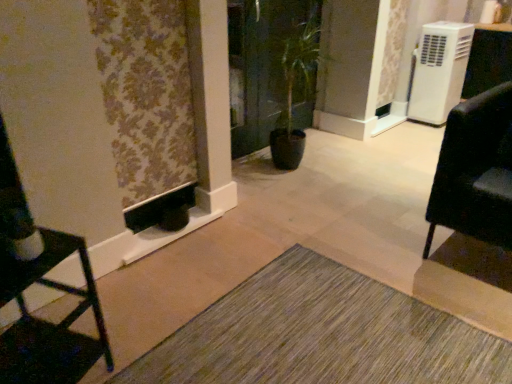
Question: From a real-world perspective, is white plastic air conditioner at upper right below matte black chair at left, the second furniture when ordered from right to left?

Choices:
 (A) yes
 (B) no

Answer: (B)

Question: Considering the relative sizes of white plastic air conditioner at upper right and matte black chair at left, acting as the first furniture starting from the front, in the image provided, is white plastic air conditioner at upper right wider than matte black chair at left, acting as the first furniture starting from the front,?

Choices:
 (A) yes
 (B) no

Answer: (B)

Question: Does white plastic air conditioner at upper right have a lesser height compared to matte black chair at left, the second furniture when ordered from right to left?

Choices:
 (A) no
 (B) yes

Answer: (A)

Question: Is there a large distance between white plastic air conditioner at upper right and matte black chair at left, acting as the first furniture starting from the front?

Choices:
 (A) yes
 (B) no

Answer: (A)

Question: From a real-world perspective, is white plastic air conditioner at upper right positioned over matte black chair at left, the second furniture when ordered from right to left, based on gravity?

Choices:
 (A) yes
 (B) no

Answer: (A)

Question: Is black leather chair at right, the 2th furniture viewed from the left, to the left or to the right of green glossy screen door at center in the image?

Choices:
 (A) right
 (B) left

Answer: (A)

Question: From a real-world perspective, is black leather chair at right, which appears as the second furniture when viewed from the front, above or below green glossy screen door at center?

Choices:
 (A) above
 (B) below

Answer: (B)

Question: From the image's perspective, is black leather chair at right, which is the first furniture from back to front, positioned above or below green glossy screen door at center?

Choices:
 (A) above
 (B) below

Answer: (B)

Question: In the image, is black leather chair at right, the 1th furniture positioned from the right, positioned in front of or behind green glossy screen door at center?

Choices:
 (A) behind
 (B) front

Answer: (B)

Question: Visually, is matte black chair at left, the second furniture when ordered from right to left, positioned to the left or to the right of green textured mat at lower center?

Choices:
 (A) left
 (B) right

Answer: (A)

Question: From a real-world perspective, is matte black chair at left, the second furniture when ordered from back to front, physically located above or below green textured mat at lower center?

Choices:
 (A) below
 (B) above

Answer: (B)

Question: Considering the positions of matte black chair at left, acting as the first furniture starting from the left, and green textured mat at lower center in the image, is matte black chair at left, acting as the first furniture starting from the left, bigger or smaller than green textured mat at lower center?

Choices:
 (A) big
 (B) small

Answer: (A)

Question: Looking at their shapes, would you say matte black chair at left, the second furniture when ordered from back to front, is wider or thinner than green textured mat at lower center?

Choices:
 (A) thin
 (B) wide

Answer: (A)

Question: In terms of width, does green textured mat at lower center look wider or thinner when compared to matte black chair at left, the second furniture when ordered from back to front?

Choices:
 (A) thin
 (B) wide

Answer: (B)

Question: From their relative heights in the image, would you say green textured mat at lower center is taller or shorter than matte black chair at left, acting as the first furniture starting from the left?

Choices:
 (A) tall
 (B) short

Answer: (B)